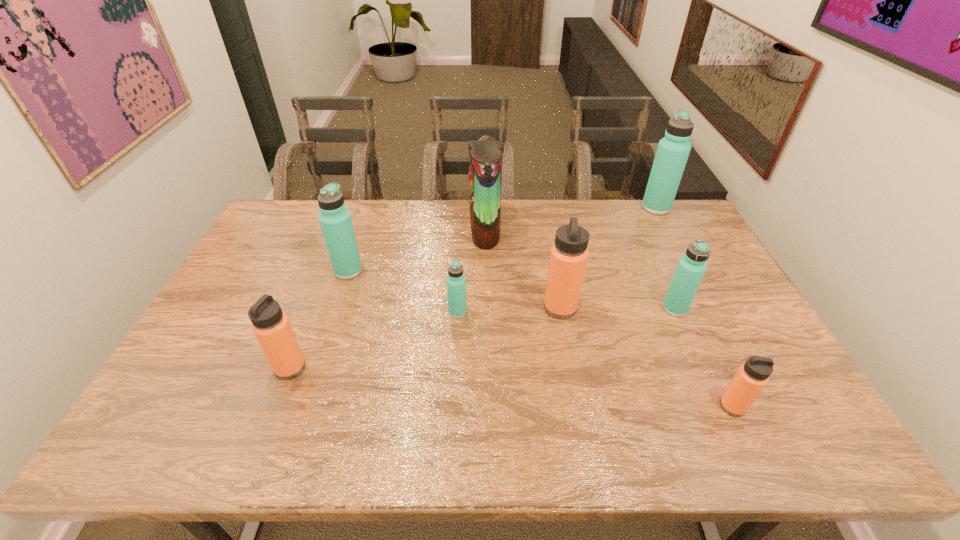
Identify the location of the rightmost aqua thermos bottle. (673, 150).

Identify the location of the farthest thermos bottle. This screenshot has height=540, width=960. (673, 150).

Identify the location of parrot. The image size is (960, 540). (486, 155).

Identify the location of the sixth nearest object. Image resolution: width=960 pixels, height=540 pixels. (335, 220).

The height and width of the screenshot is (540, 960). Identify the location of the second farthest aqua thermos bottle. (335, 220).

Where is `the fourth thermos bottle from left to right`? the fourth thermos bottle from left to right is located at coordinates (569, 254).

This screenshot has width=960, height=540. I want to click on the fifth object from left to right, so click(x=569, y=254).

The image size is (960, 540). Find the location of `the second smallest aqua thermos bottle`. the second smallest aqua thermos bottle is located at coordinates (691, 267).

This screenshot has height=540, width=960. What are the coordinates of `the second nearest thermos bottle` in the screenshot? It's located at (271, 327).

Identify the location of the second farthest orange thermos bottle. This screenshot has width=960, height=540. (271, 327).